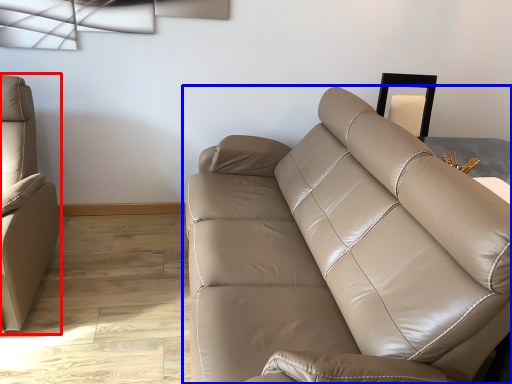
Question: Which point is further to the camera, studio couch (highlighted by a red box) or studio couch (highlighted by a blue box)?

Choices:
 (A) studio couch
 (B) studio couch

Answer: (A)